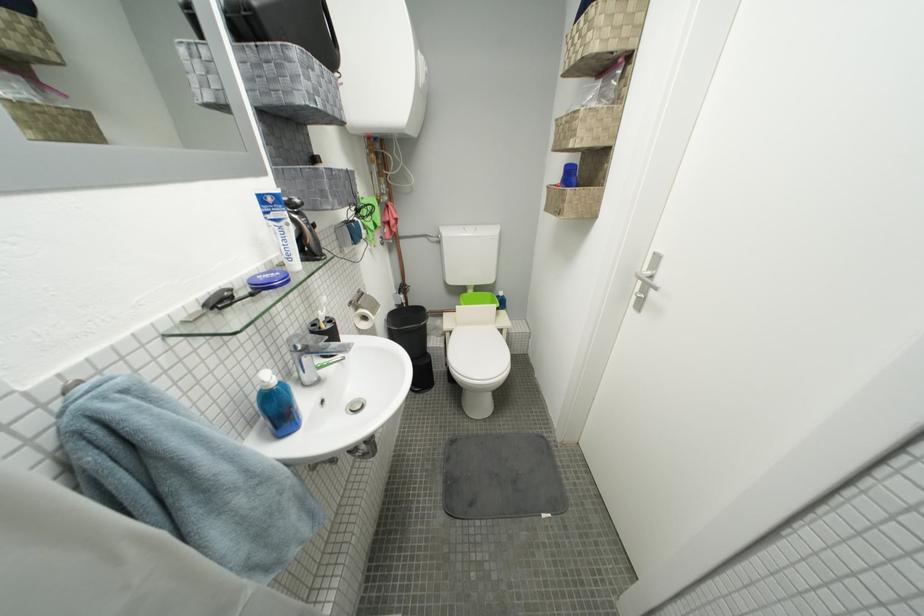
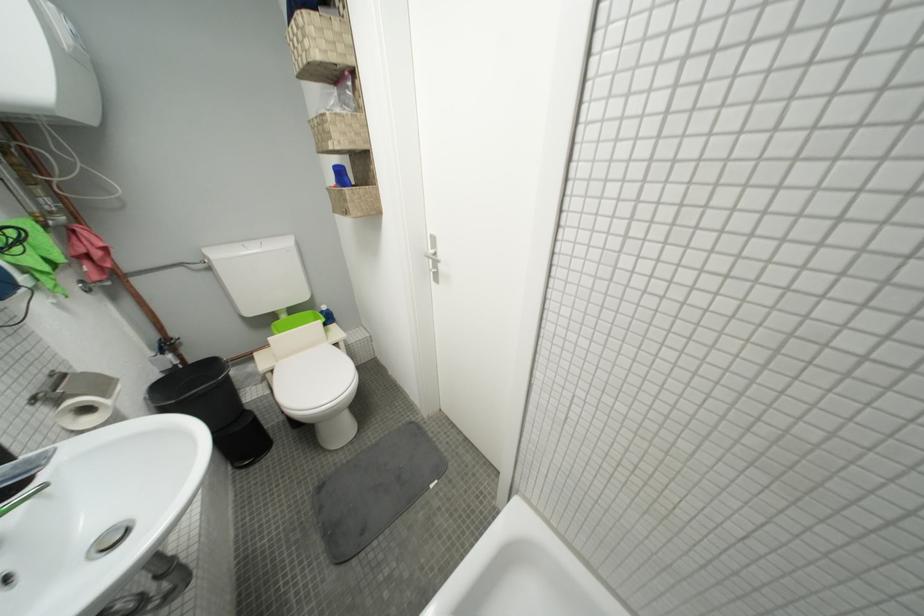
The point at (603, 107) is marked in the first image. Where is the corresponding point in the second image?

(346, 113)